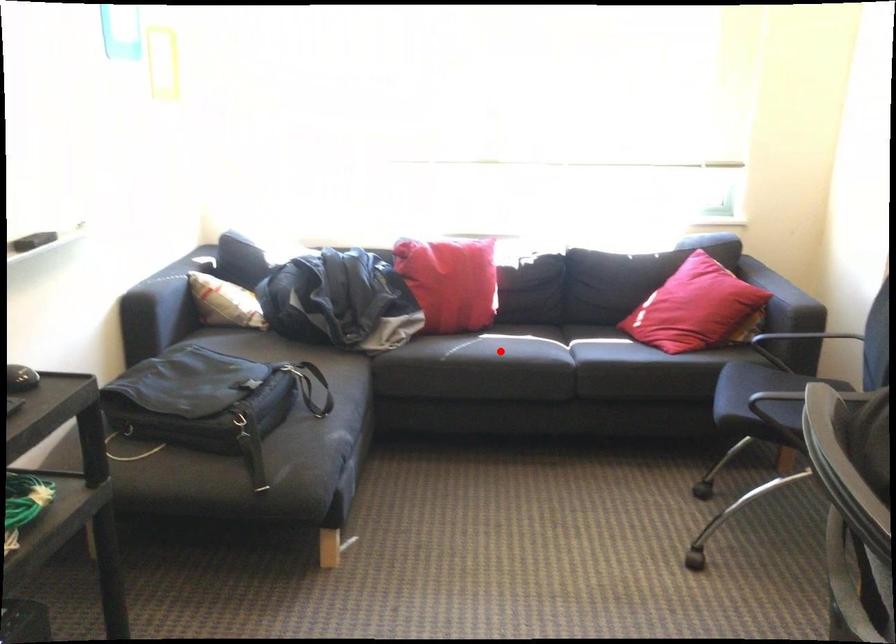
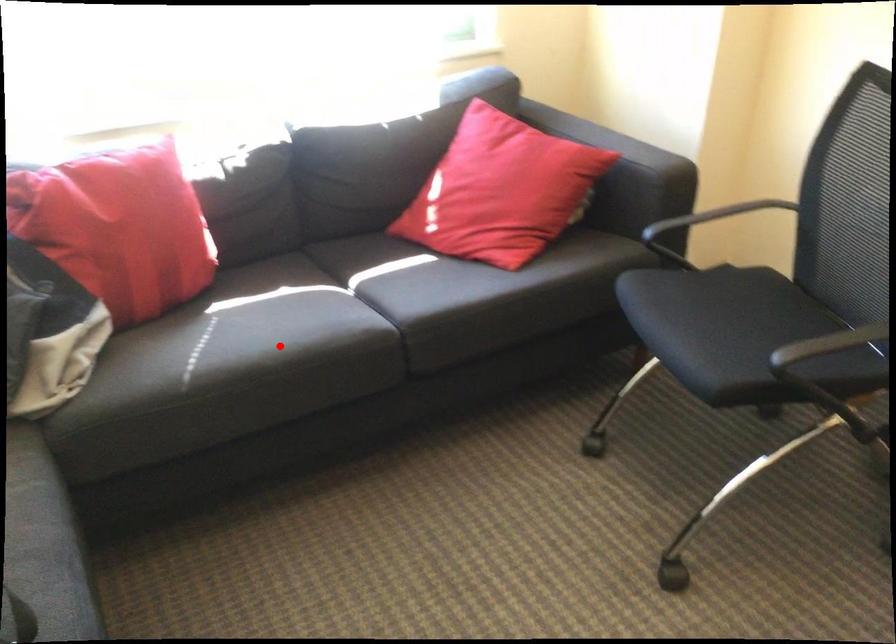
I am providing you with two images of the same scene from different viewpoints. A red point is marked on the first image and another point is marked on the second image. Do the highlighted points in image1 and image2 indicate the same real-world spot?

Yes